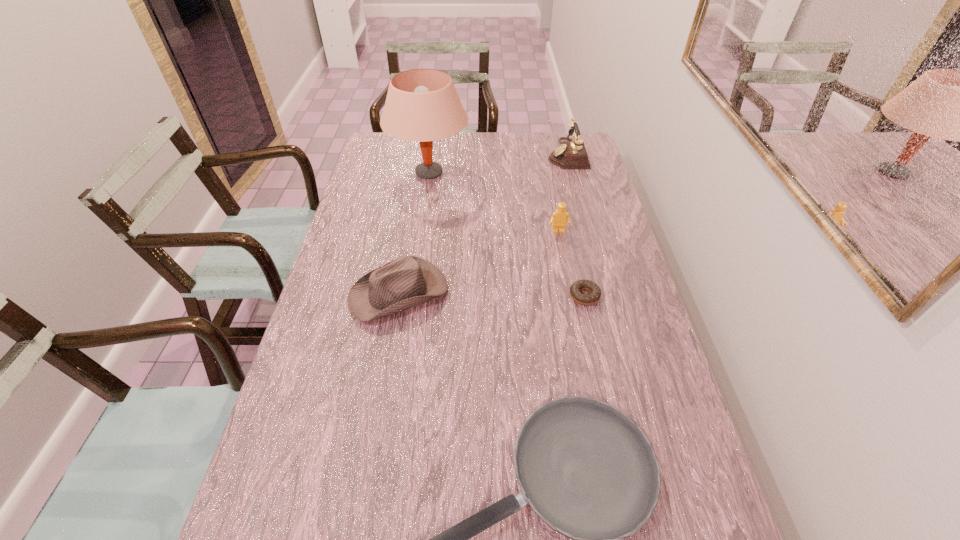
I want to click on object present at the far right corner, so click(571, 154).

Locate an element on the screen. blank space at the far edge of the desktop is located at coordinates (460, 158).

This screenshot has height=540, width=960. I want to click on free region at the left edge, so click(303, 510).

This screenshot has width=960, height=540. Identify the location of vacant space at the right edge of the desktop. (690, 468).

Image resolution: width=960 pixels, height=540 pixels. In order to click on vacant region at the far left corner of the desktop in this screenshot , I will do `click(401, 153)`.

The height and width of the screenshot is (540, 960). In the image, there is a desktop. What are the coordinates of `vacant region at the far right corner` in the screenshot? It's located at (553, 137).

Find the location of `free space between the tallest object and the doughnut`. free space between the tallest object and the doughnut is located at coordinates (507, 234).

Where is `vacant area that lies between the tallest object and the telephone`? This screenshot has height=540, width=960. vacant area that lies between the tallest object and the telephone is located at coordinates click(x=498, y=163).

What are the coordinates of `vacant area between the telephone and the lampshade` in the screenshot? It's located at 498,163.

You are a GUI agent. You are given a task and a screenshot of the screen. Output one action in this format:
    pyautogui.click(x=<x>, y=<y>)
    Task: Click on the free space between the doughnut and the telephone
    The image size is (960, 540).
    Given the screenshot: What is the action you would take?
    pyautogui.click(x=576, y=225)